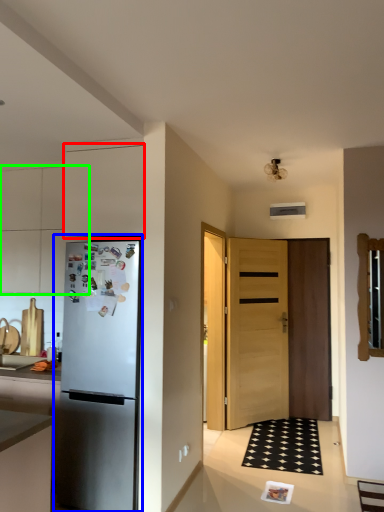
Question: Based on their relative distances, which object is nearer to cabinetry (highlighted by a red box)? Choose from refrigerator (highlighted by a blue box) and cabinetry (highlighted by a green box).

Choices:
 (A) refrigerator
 (B) cabinetry

Answer: (A)